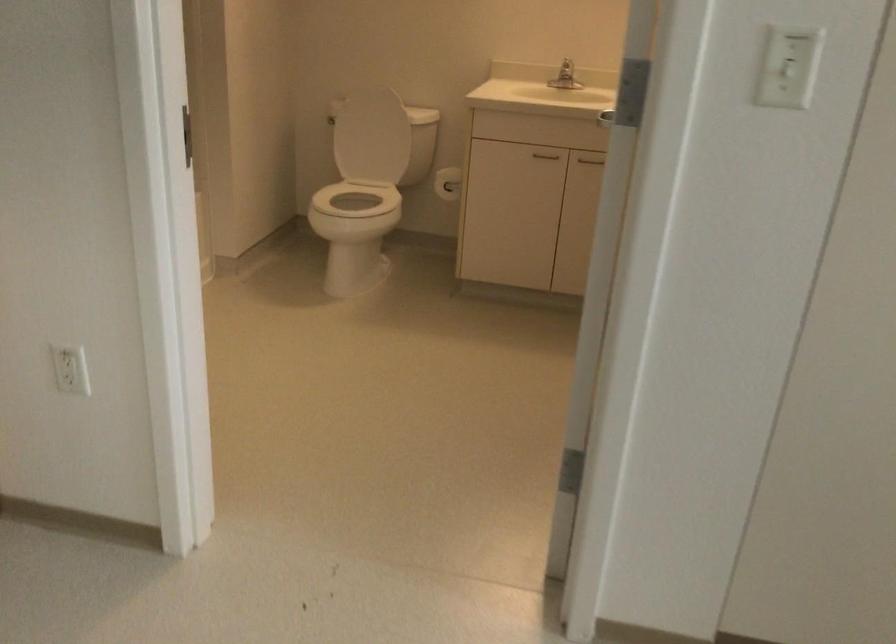
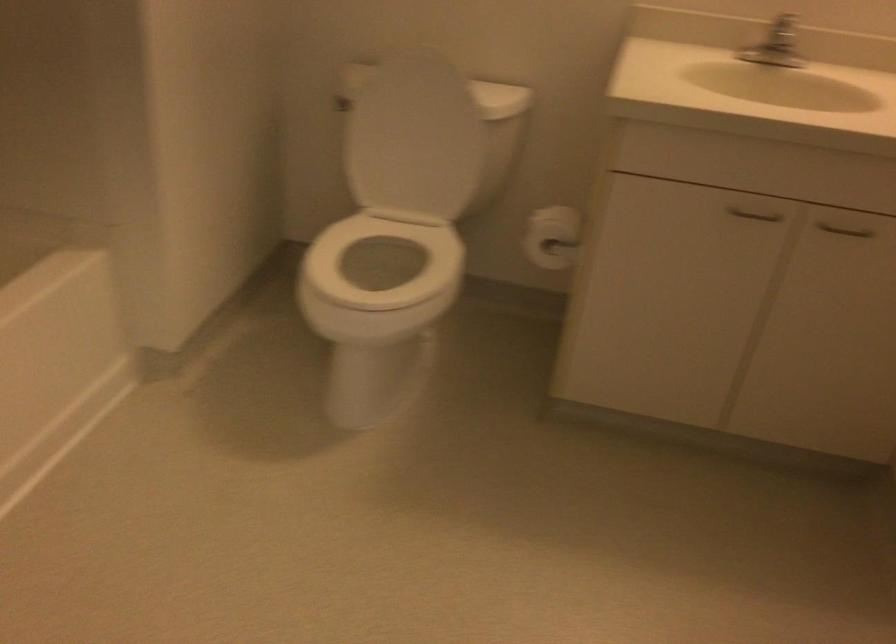
In the second image, find the point that corresponds to (x=547, y=154) in the first image.

(754, 214)